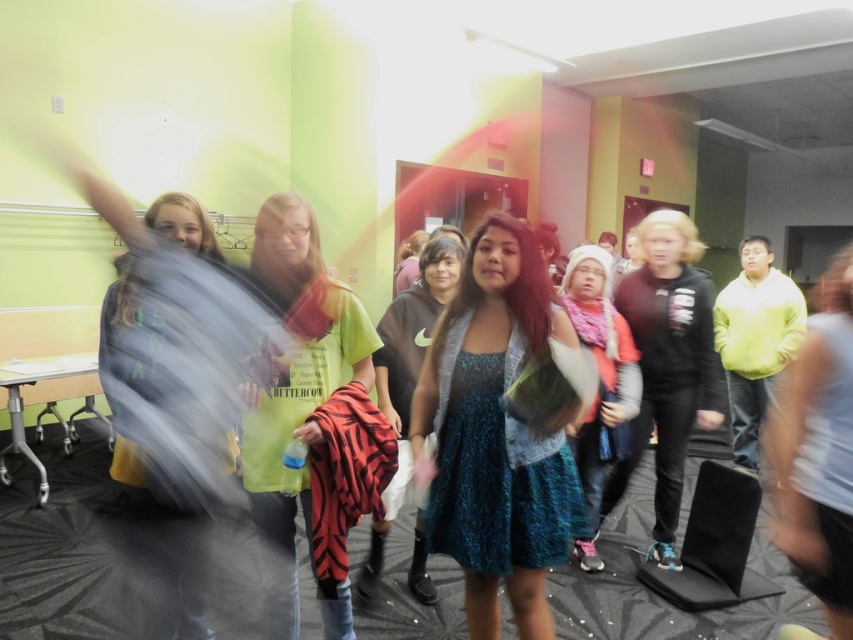
Is point (274, 205) positioned behind point (422, 588)?

That is False.

Who is taller, yellow-green t-shirt at center or blue sequined dress at center?

Standing taller between the two is blue sequined dress at center.

Is point (305, 352) less distant than point (381, 344)?

Yes, point (305, 352) is in front of point (381, 344).

This screenshot has height=640, width=853. Identify the location of yellow-green t-shirt at center. (294, 385).

Is point (379, 547) less distant than point (599, 468)?

Yes, it is.

Consider the image. Who is positioned more to the right, blue sequined dress at center or knitted pink scarf at center?

Positioned to the right is knitted pink scarf at center.

You are a GUI agent. You are given a task and a screenshot of the screen. Output one action in this format:
    pyautogui.click(x=<x>, y=<y>)
    Task: Click on the blue sequined dress at center
    This screenshot has width=853, height=640.
    Given the screenshot: What is the action you would take?
    pyautogui.click(x=407, y=371)

Between yellow-green t-shirt at center and knitted pink scarf at center, which one has more height?

Standing taller between the two is knitted pink scarf at center.

Which is below, yellow-green t-shirt at center or knitted pink scarf at center?

knitted pink scarf at center

The height and width of the screenshot is (640, 853). What do you see at coordinates (294, 385) in the screenshot?
I see `yellow-green t-shirt at center` at bounding box center [294, 385].

At what (x,y) coordinates should I click in order to perform the action: click on yellow-green t-shirt at center. Please return your answer as a coordinate pair (x, y). The width and height of the screenshot is (853, 640). Looking at the image, I should click on (294, 385).